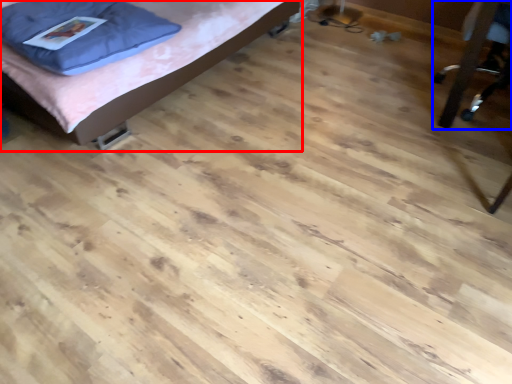
Question: Which object is closer to the camera taking this photo, bed (highlighted by a red box) or furniture (highlighted by a blue box)?

Choices:
 (A) bed
 (B) furniture

Answer: (A)